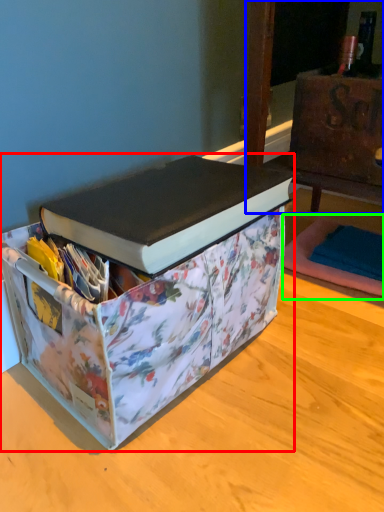
Question: Which is farther away from box (highlighted by a red box)? furniture (highlighted by a blue box) or yoga mat (highlighted by a green box)?

Choices:
 (A) furniture
 (B) yoga mat

Answer: (B)